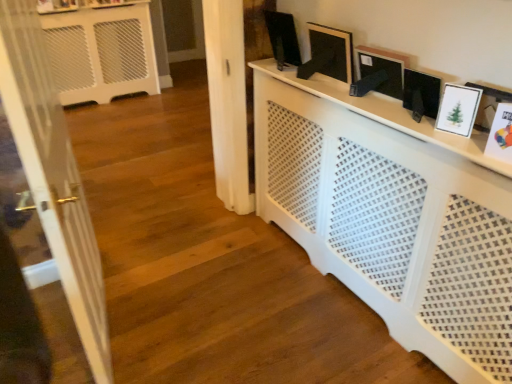
Locate an element on the screen. unoccupied space behind white glossy door at left is located at coordinates (163, 266).